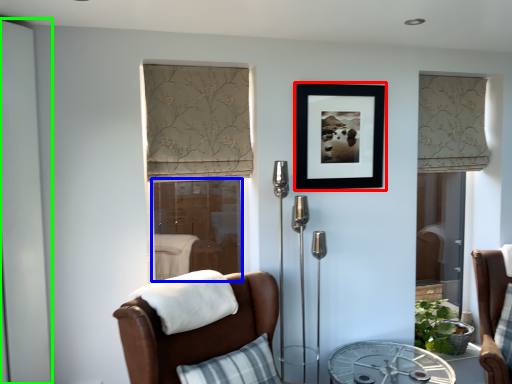
Question: Estimate the real-world distances between objects in this image. Which object is closer to picture frame (highlighted by a red box), screen door (highlighted by a blue box) or screen door (highlighted by a green box)?

Choices:
 (A) screen door
 (B) screen door

Answer: (B)